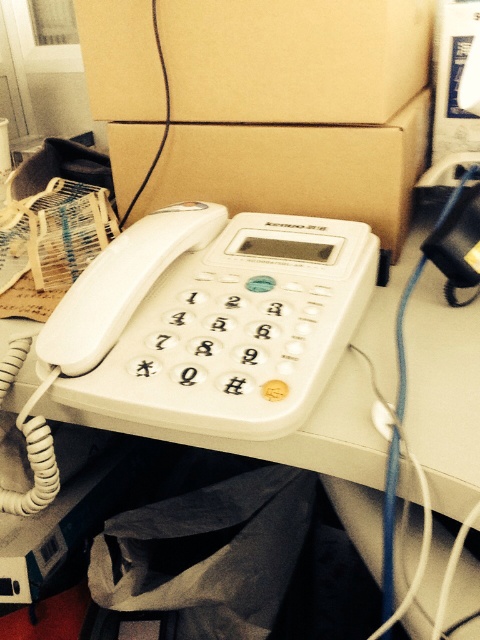
You are trying to place the white plastic phone at upper center into the brown cardboard box at center. Based on their sizes, will the phone fit inside the box?

The white plastic phone at upper center has a greater height compared to the brown cardboard box at center, so the phone cannot fit inside the box since it is taller than the box.

You are trying to reach the brown cardboard box at center on the desk but there is a white plastic phone at upper center in the way. Can you move the phone to access the box?

The white plastic phone at upper center is closer to the viewer than the brown cardboard box at center, so you can move the phone to access the box.